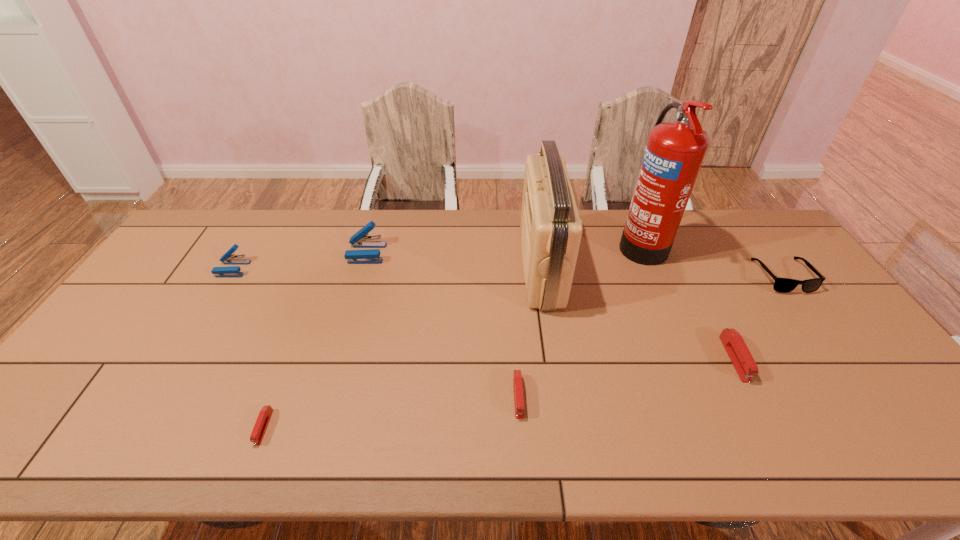
You are a GUI agent. You are given a task and a screenshot of the screen. Output one action in this format:
    pyautogui.click(x=<x>, y=<y>)
    Task: Click on the unoccupied position between the fourth stapler from left to right and the red fire extinguisher
    Image resolution: width=960 pixels, height=540 pixels.
    Given the screenshot: What is the action you would take?
    pos(580,320)

At what (x,y) coordinates should I click in order to perform the action: click on blank region between the third object from left to right and the sixth object from left to right. Please return your answer as a coordinate pair (x, y). Image resolution: width=960 pixels, height=540 pixels. Looking at the image, I should click on (504, 248).

Where is `empty space that is in between the rightmost object and the second tallest stapler`? empty space that is in between the rightmost object and the second tallest stapler is located at coordinates (508, 273).

Identify which object is the seventh closest to the sunglasses. Please provide its 2D coordinates. Your answer should be formatted as a tuple, i.e. [(x, y)], where the tuple contains the x and y coordinates of a point satisfying the conditions above.

[(232, 271)]

Select which object appears as the second closest to the fourth tallest object. Please provide its 2D coordinates. Your answer should be formatted as a tuple, i.e. [(x, y)], where the tuple contains the x and y coordinates of a point satisfying the conditions above.

[(264, 416)]

The height and width of the screenshot is (540, 960). I want to click on stapler that is the fifth closest to the beige radio receiver, so click(x=232, y=271).

This screenshot has width=960, height=540. I want to click on the second closest stapler relative to the second object from right to left, so click(x=360, y=239).

Select which red stapler is the second closest to the second red stapler from left to right. Please provide its 2D coordinates. Your answer should be formatted as a tuple, i.e. [(x, y)], where the tuple contains the x and y coordinates of a point satisfying the conditions above.

[(264, 416)]

Where is `red stapler object that ranks as the second closest to the third tallest object`? This screenshot has height=540, width=960. red stapler object that ranks as the second closest to the third tallest object is located at coordinates (517, 375).

You are a GUI agent. You are given a task and a screenshot of the screen. Output one action in this format:
    pyautogui.click(x=<x>, y=<y>)
    Task: Click on the free space that satisfies the following two spatial constraints: 1. on the surface of the tallest object; 2. on the front side of the right blue stapler
    
    Given the screenshot: What is the action you would take?
    pyautogui.click(x=645, y=253)